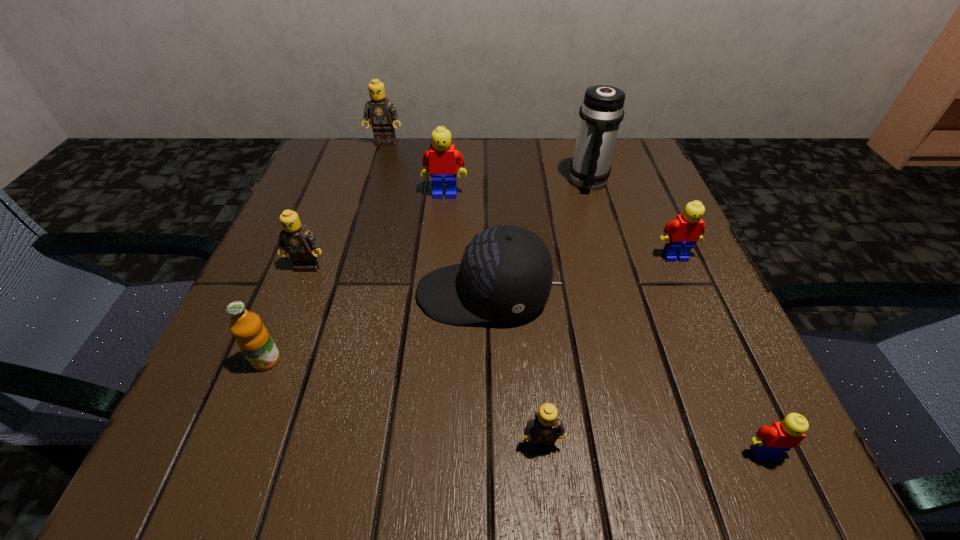
This screenshot has width=960, height=540. In order to click on thermos bottle in this screenshot , I will do `click(602, 111)`.

This screenshot has height=540, width=960. Identify the location of the seventh object from left to right. 602,111.

Where is `the farthest Lego`? The width and height of the screenshot is (960, 540). the farthest Lego is located at coordinates (381, 112).

This screenshot has height=540, width=960. In order to click on the farthest object in this screenshot , I will do coord(381,112).

Where is `the leftmost yellow Lego`? This screenshot has height=540, width=960. the leftmost yellow Lego is located at coordinates (443, 160).

This screenshot has height=540, width=960. Find the location of `the farthest yellow Lego`. the farthest yellow Lego is located at coordinates (443, 160).

Locate an element on the screen. This screenshot has width=960, height=540. baseball cap is located at coordinates (506, 272).

Locate an element on the screen. The image size is (960, 540). the second smallest yellow Lego is located at coordinates (681, 234).

You are a GUI agent. You are given a task and a screenshot of the screen. Output one action in this format:
    pyautogui.click(x=<x>, y=<y>)
    Task: Click on the second farthest tan Lego
    Image resolution: width=960 pixels, height=540 pixels.
    Given the screenshot: What is the action you would take?
    pyautogui.click(x=295, y=239)

Where is `orange juice`? Image resolution: width=960 pixels, height=540 pixels. orange juice is located at coordinates (252, 337).